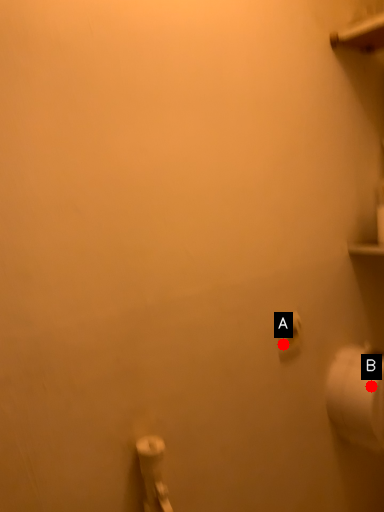
Question: Two points are circled on the image, labeled by A and B beside each circle. Which point appears closest to the camera in this image?

Choices:
 (A) A is closer
 (B) B is closer

Answer: (A)